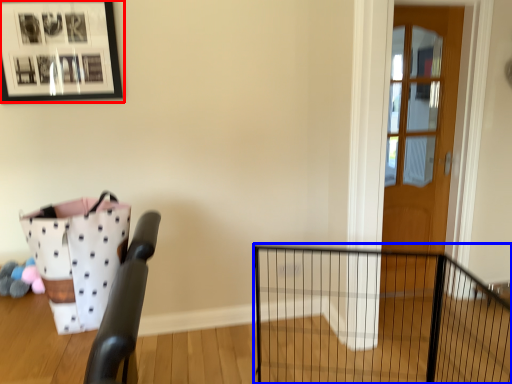
Question: Which object appears farthest to the camera in this image, picture frame (highlighted by a red box) or fence (highlighted by a blue box)?

Choices:
 (A) picture frame
 (B) fence

Answer: (A)